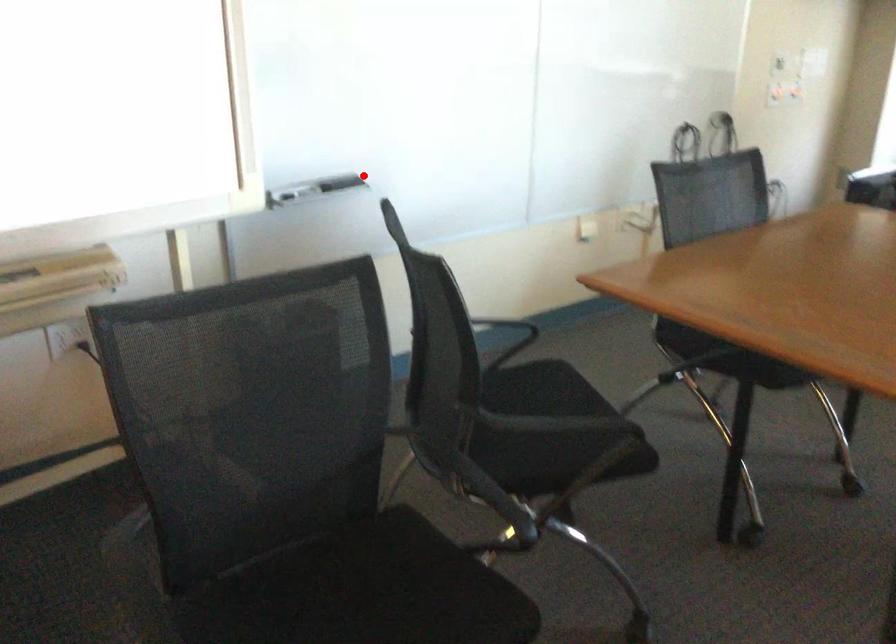
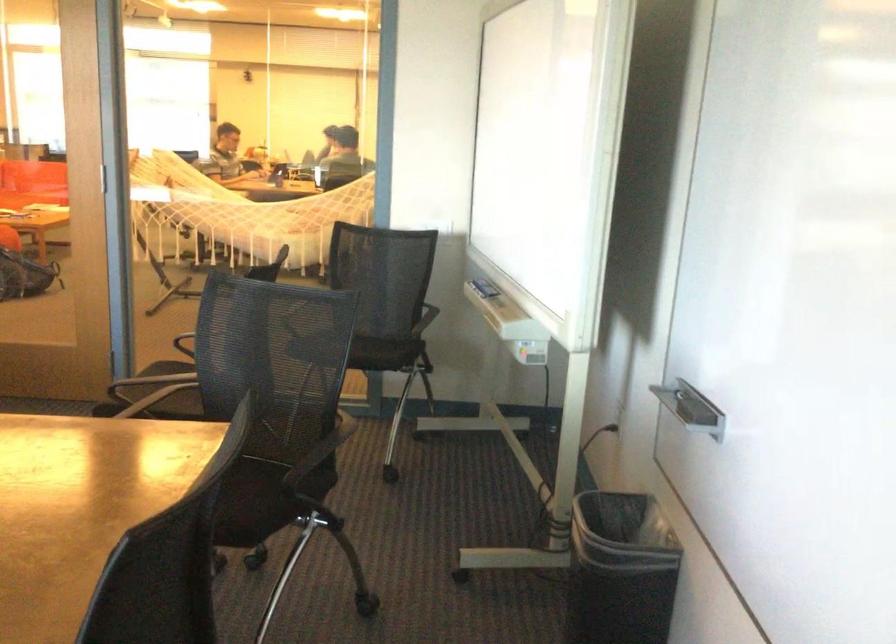
Find the pixel in the second image that matches the highlighted location in the first image.

(691, 408)